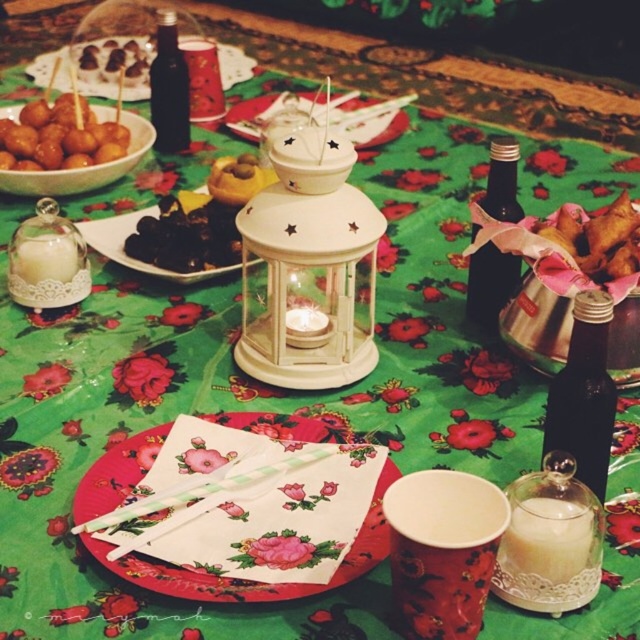
Can you confirm if matte brown plate at upper left is wider than yellow matte pastry at center?

Indeed, matte brown plate at upper left has a greater width compared to yellow matte pastry at center.

Locate an element on the screen. Image resolution: width=640 pixels, height=640 pixels. matte brown plate at upper left is located at coordinates (234, 65).

Is black glossy grapes at center further to the viewer compared to black glass bottle at center?

No, it is in front of black glass bottle at center.

Can you confirm if black glossy grapes at center is shorter than black glass bottle at center?

Yes.

The image size is (640, 640). I want to click on black glossy grapes at center, so click(x=186, y=236).

Which of these two, translucent glass platter at center or matte brown plate at upper left, stands taller?

With more height is matte brown plate at upper left.

Does translucent glass platter at center appear on the left side of matte brown plate at upper left?

No, translucent glass platter at center is not to the left of matte brown plate at upper left.

The width and height of the screenshot is (640, 640). I want to click on translucent glass platter at center, so click(365, 116).